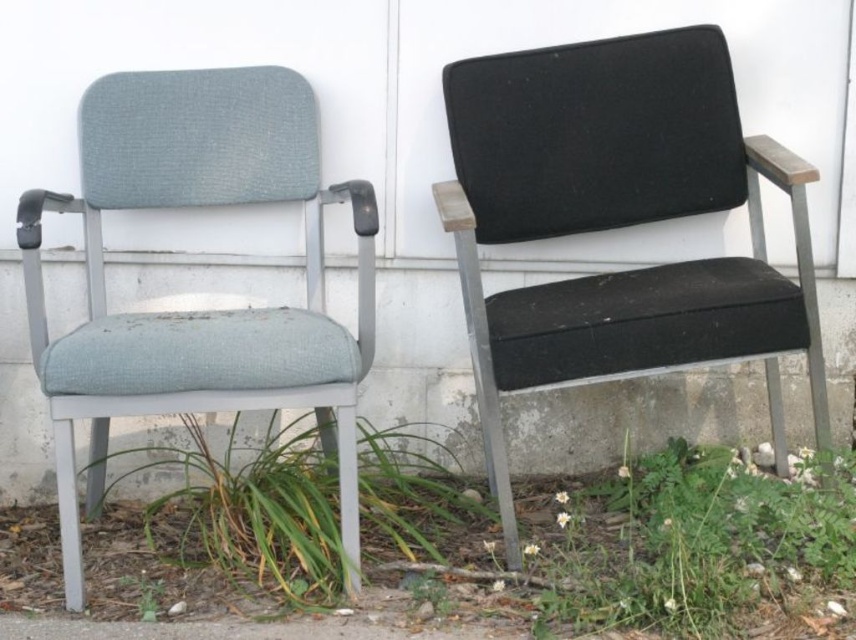
From the picture: Which of these two, black fabric chair at right or green leafy grass at lower center, stands shorter?

With less height is green leafy grass at lower center.

Does black fabric chair at right appear under green leafy grass at lower center?

Incorrect, black fabric chair at right is not positioned below green leafy grass at lower center.

I want to click on black fabric chair at right, so click(617, 221).

Is matte gray fabric chair at left wider than green leafy grass at lower center?

Incorrect, matte gray fabric chair at left's width does not surpass green leafy grass at lower center's.

Which is above, matte gray fabric chair at left or green leafy grass at lower center?

matte gray fabric chair at left is above.

What are the coordinates of `matte gray fabric chair at left` in the screenshot? It's located at (198, 310).

Looking at this image, is black fabric chair at right to the left of matte gray fabric chair at left from the viewer's perspective?

No, black fabric chair at right is not to the left of matte gray fabric chair at left.

Who is more forward, (467,196) or (306,81)?

Point (467,196) is more forward.

Locate an element on the screen. Image resolution: width=856 pixels, height=640 pixels. black fabric chair at right is located at coordinates (617, 221).